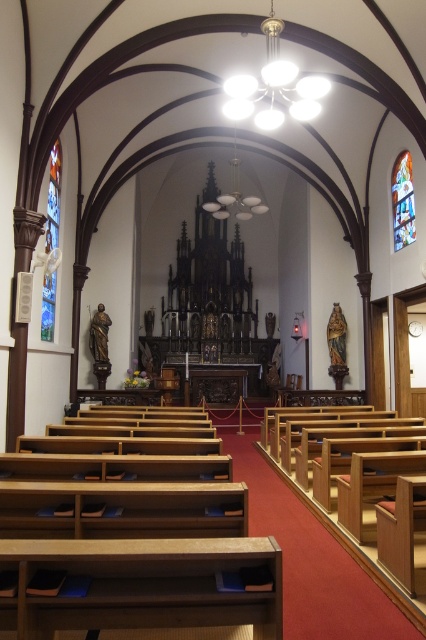
Question: Does stained glass window at left come in front of stained glass at upper right?

Choices:
 (A) yes
 (B) no

Answer: (A)

Question: Is the position of stained glass window at left less distant than that of stained glass at upper right?

Choices:
 (A) yes
 (B) no

Answer: (A)

Question: Among these points, which one is farthest from the camera?

Choices:
 (A) (58, 204)
 (B) (400, 227)

Answer: (B)

Question: Among these points, which one is farthest from the camera?

Choices:
 (A) (52, 220)
 (B) (406, 198)

Answer: (B)

Question: Among these objects, which one is farthest from the camera?

Choices:
 (A) stained glass at upper right
 (B) stained glass window at left

Answer: (A)

Question: Does stained glass window at left have a lesser width compared to stained glass at upper right?

Choices:
 (A) no
 (B) yes

Answer: (A)